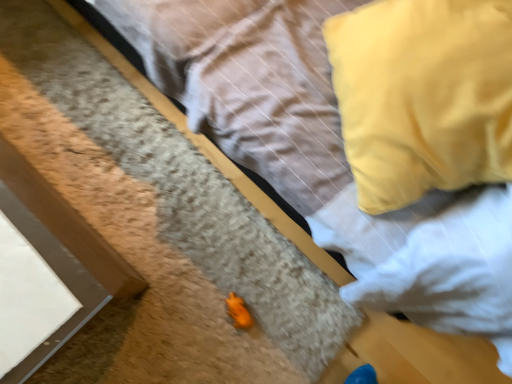
Locate an element on the screen. This screenshot has height=384, width=512. vacant space behind orange matte toy frog at lower center is located at coordinates (266, 260).